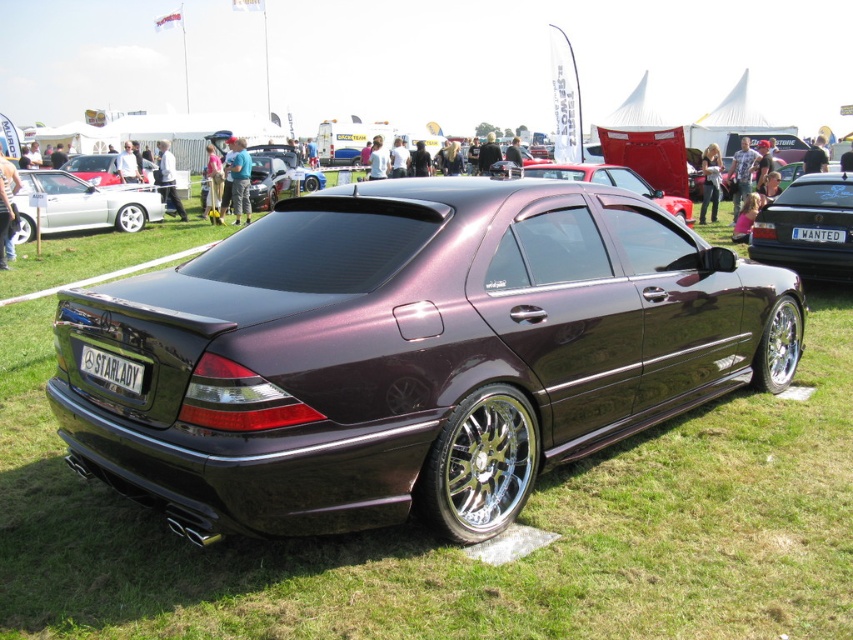
Question: Considering the relative positions of shiny white car at left and white plastic license plate at center in the image provided, where is shiny white car at left located with respect to white plastic license plate at center?

Choices:
 (A) right
 (B) left

Answer: (B)

Question: Which object is farther from the camera taking this photo?

Choices:
 (A) black matte license plate at rear
 (B) shiny metallic car at center

Answer: (B)

Question: Which object is positioned farthest from the shiny metallic car at center?

Choices:
 (A) metallic maroon sedan at center
 (B) shiny white car at left
 (C) chrome metallic wheel at center
 (D) shiny chrome wheel at center-right

Answer: (C)

Question: Which point appears closest to the camera in this image?

Choices:
 (A) (294, 154)
 (B) (537, 436)
 (C) (138, 220)
 (D) (790, 349)

Answer: (B)

Question: Is black matte license plate at rear to the right of shiny metallic car at center from the viewer's perspective?

Choices:
 (A) yes
 (B) no

Answer: (A)

Question: Does metallic maroon sedan at center appear on the right side of shiny silver rim at rear?

Choices:
 (A) no
 (B) yes

Answer: (B)